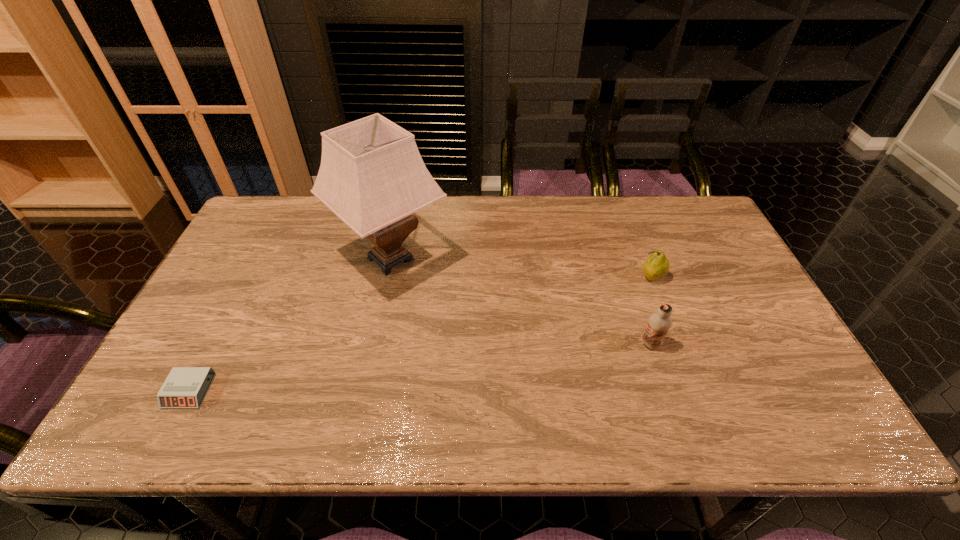
At what (x,y) coordinates should I click in order to perform the action: click on free space at the far left corner of the desktop. Please return your answer as a coordinate pair (x, y). Image resolution: width=960 pixels, height=540 pixels. Looking at the image, I should click on (286, 202).

You are a GUI agent. You are given a task and a screenshot of the screen. Output one action in this format:
    pyautogui.click(x=<x>, y=<y>)
    Task: Click on the vacant region between the rightmost object and the third shortest object
    
    Given the screenshot: What is the action you would take?
    pyautogui.click(x=651, y=310)

Locate an element on the screen. This screenshot has width=960, height=540. free area in between the leftmost object and the third tallest object is located at coordinates (420, 334).

Where is `free space between the third shortest object and the rightmost object`? Image resolution: width=960 pixels, height=540 pixels. free space between the third shortest object and the rightmost object is located at coordinates (651, 310).

Image resolution: width=960 pixels, height=540 pixels. What are the coordinates of `free space between the second object from left to right and the pear` in the screenshot? It's located at (521, 268).

Image resolution: width=960 pixels, height=540 pixels. In order to click on free space between the chocolate milk and the third object from right to left in this screenshot , I will do `click(520, 301)`.

Identify the location of free area in between the rightmost object and the shortest object. (420, 334).

Where is `free space between the third shortest object and the tallest object`? The width and height of the screenshot is (960, 540). free space between the third shortest object and the tallest object is located at coordinates (520, 301).

Where is `vacant area that lies between the tallest object and the second nearest object`? vacant area that lies between the tallest object and the second nearest object is located at coordinates (520, 301).

You are a GUI agent. You are given a task and a screenshot of the screen. Output one action in this format:
    pyautogui.click(x=<x>, y=<y>)
    Task: Click on the free space between the lampshade and the second tallest object
    The width and height of the screenshot is (960, 540).
    Given the screenshot: What is the action you would take?
    pyautogui.click(x=520, y=301)